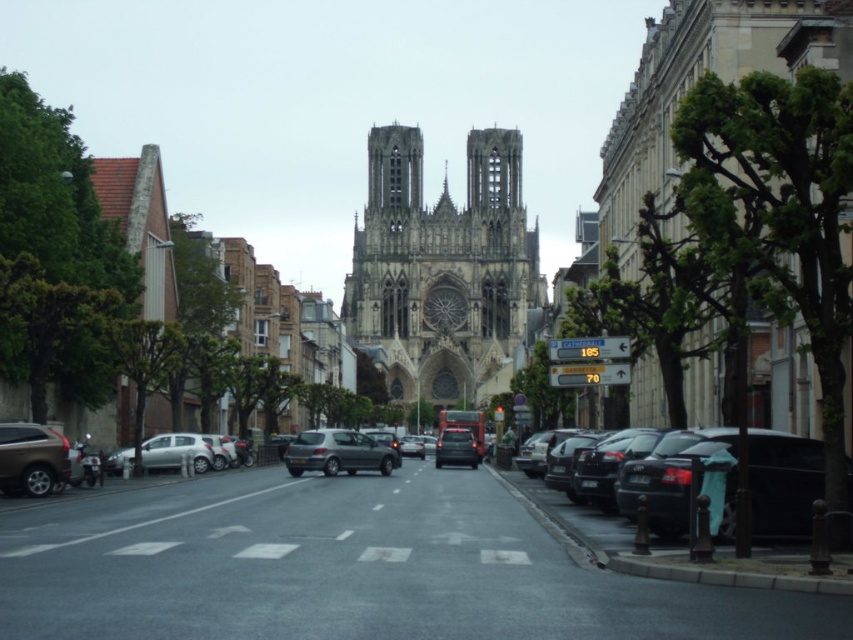
Who is positioned more to the left, matte brown suv at lower left or satin silver hatchback at center?

matte brown suv at lower left is more to the left.

Is point (39, 438) farther from viewer compared to point (335, 429)?

That is False.

I want to click on matte brown suv at lower left, so click(32, 458).

Can you confirm if dark gray metallic car at right is smaller than matte brown suv at lower left?

Incorrect, dark gray metallic car at right is not smaller in size than matte brown suv at lower left.

Which is below, dark gray metallic car at right or matte brown suv at lower left?

dark gray metallic car at right is below.

This screenshot has width=853, height=640. I want to click on dark gray metallic car at right, so (648, 486).

Is stone gothic cathedral at center to the left of matte black car at center from the viewer's perspective?

Indeed, stone gothic cathedral at center is positioned on the left side of matte black car at center.

Describe the element at coordinates (442, 269) in the screenshot. The width and height of the screenshot is (853, 640). I see `stone gothic cathedral at center` at that location.

Where is `stone gothic cathedral at center`? Image resolution: width=853 pixels, height=640 pixels. stone gothic cathedral at center is located at coordinates (442, 269).